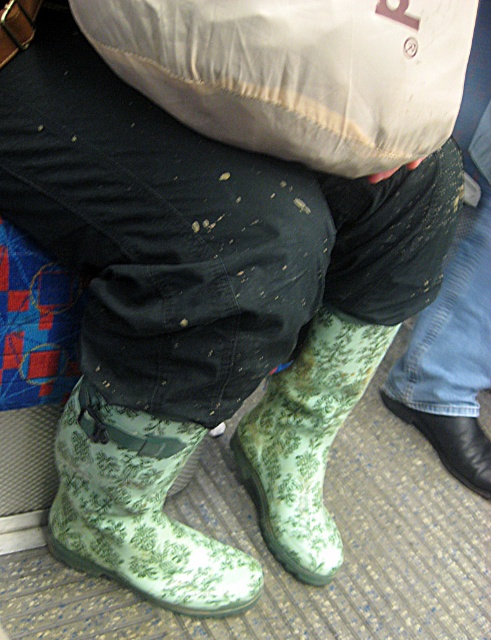
Can you confirm if green floral rubber boot at center is positioned above black leather boot at lower right?

Correct, green floral rubber boot at center is located above black leather boot at lower right.

What do you see at coordinates (305, 440) in the screenshot? The height and width of the screenshot is (640, 491). I see `green floral rubber boot at center` at bounding box center [305, 440].

Locate an element on the screen. green floral rubber boot at center is located at coordinates (305, 440).

Is white fabric sack at upper center positioned at the back of black leather boot at lower right?

No.

This screenshot has height=640, width=491. I want to click on white fabric sack at upper center, so click(296, 72).

Who is higher up, green floral rubber boot at lower center or black leather boot at lower right?

Positioned higher is black leather boot at lower right.

How much distance is there between green floral rubber boot at lower center and black leather boot at lower right?

The distance of green floral rubber boot at lower center from black leather boot at lower right is 71.46 centimeters.

Does point (141, 429) lie in front of point (452, 422)?

Yes, point (141, 429) is in front of point (452, 422).

At what (x,y) coordinates should I click in order to perform the action: click on green floral rubber boot at lower center. Please return your answer as a coordinate pair (x, y). This screenshot has width=491, height=640. Looking at the image, I should click on (137, 509).